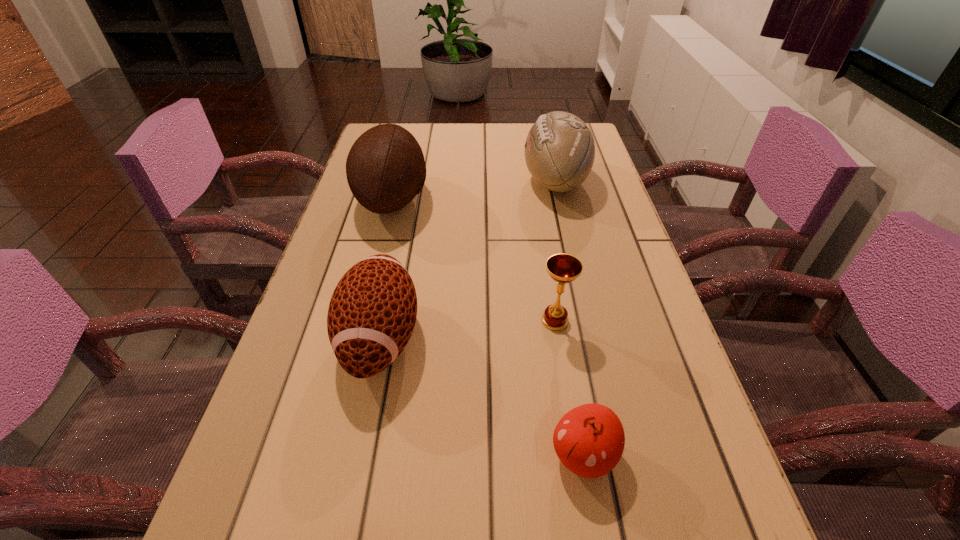
Locate an element on the screen. The height and width of the screenshot is (540, 960). the rightmost football is located at coordinates (559, 151).

Locate an element on the screen. The width and height of the screenshot is (960, 540). the shortest football is located at coordinates (372, 313).

Identify the location of chalice. The height and width of the screenshot is (540, 960). (563, 268).

At what (x,y) coordinates should I click in order to perform the action: click on the shortest object. Please return your answer as a coordinate pair (x, y). Looking at the image, I should click on (589, 440).

At what (x,y) coordinates should I click in order to perform the action: click on apple. Please return your answer as a coordinate pair (x, y). Looking at the image, I should click on (589, 440).

Identify the location of vacant region located 0.280m on the laces of the rightmost football. The width and height of the screenshot is (960, 540). (425, 180).

Identify the location of vacant space located 0.230m on the laces of the rightmost football. (443, 180).

Where is `vacant space located 0.070m on the laces of the rightmost football`? The image size is (960, 540). vacant space located 0.070m on the laces of the rightmost football is located at coordinates (498, 180).

This screenshot has width=960, height=540. Identify the location of blank space located 0.070m on the left of the nearest football. (304, 338).

Locate an element on the screen. The height and width of the screenshot is (540, 960). free location located 0.130m on the right of the chalice is located at coordinates (636, 321).